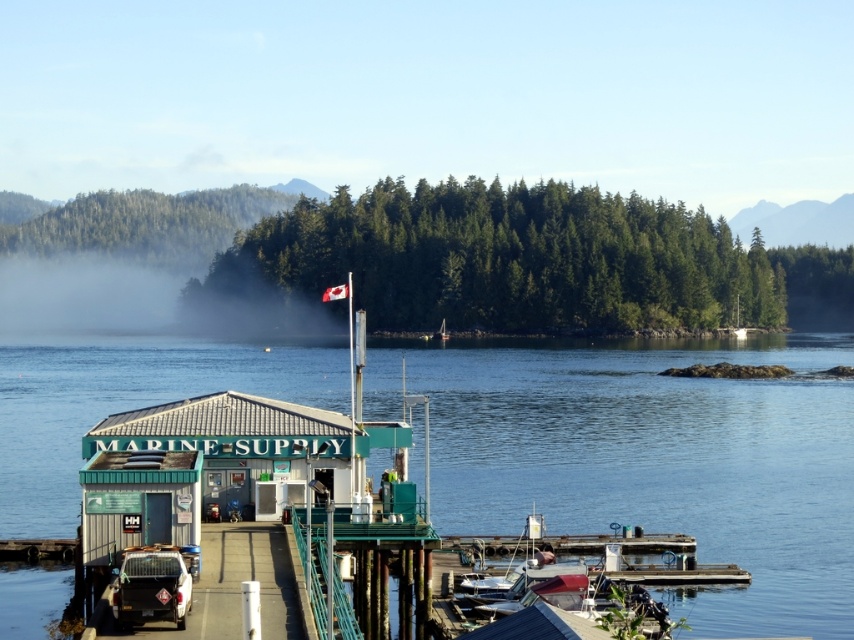
Question: Where is white matte truck at lower left located in relation to white plastic boat at center in the image?

Choices:
 (A) left
 (B) right

Answer: (A)

Question: Does clear blue water at center have a larger size compared to white matte truck at lower left?

Choices:
 (A) no
 (B) yes

Answer: (B)

Question: In this image, where is white matte truck at lower left located relative to white plastic boat at center?

Choices:
 (A) below
 (B) above

Answer: (A)

Question: Which point is farther to the camera?

Choices:
 (A) clear blue water at center
 (B) white plastic boat at center
 (C) white matte truck at lower left

Answer: (B)

Question: Which of these objects is positioned farthest from the white matte truck at lower left?

Choices:
 (A) clear blue water at center
 (B) white plastic boat at center

Answer: (B)

Question: Which point is closer to the camera taking this photo?

Choices:
 (A) (738, 328)
 (B) (164, 550)
 (C) (844, 412)

Answer: (B)